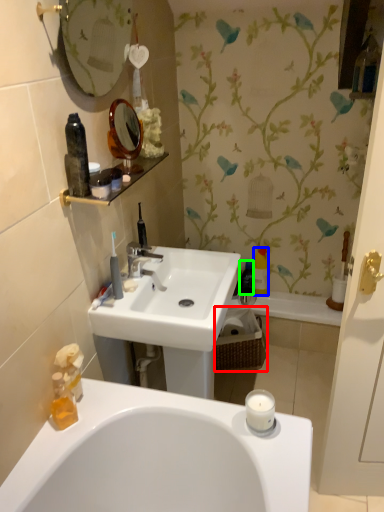
Question: Which object is positioned closest to picnic basket (highlighted by a red box)? Select from bottle (highlighted by a blue box) and bottle (highlighted by a green box).

Choices:
 (A) bottle
 (B) bottle

Answer: (B)